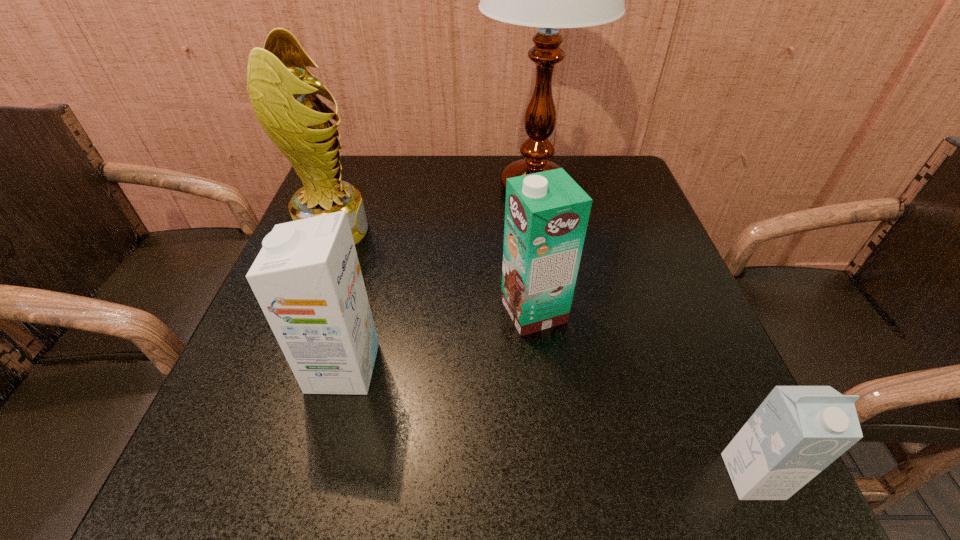
Where is `the tallest object`? the tallest object is located at coordinates (548, 0).

Locate an element on the screen. This screenshot has width=960, height=540. award is located at coordinates (283, 93).

Locate an element on the screen. This screenshot has width=960, height=540. the second carton from right to left is located at coordinates (546, 214).

Where is `the third nearest object`? This screenshot has height=540, width=960. the third nearest object is located at coordinates (546, 214).

The image size is (960, 540). What are the coordinates of `the leftmost carton` in the screenshot? It's located at (307, 279).

At what (x,y) coordinates should I click in order to perform the action: click on the fourth farthest object. Please return your answer as a coordinate pair (x, y). Looking at the image, I should click on (307, 279).

You are a GUI agent. You are given a task and a screenshot of the screen. Output one action in this format:
    pyautogui.click(x=<x>, y=<y>)
    Task: Click on the shortest object
    The image size is (960, 540).
    Given the screenshot: What is the action you would take?
    pyautogui.click(x=797, y=431)

Identify the location of the rightmost carton. Image resolution: width=960 pixels, height=540 pixels. (797, 431).

Identify the location of free space located on the right of the tallest object. (619, 188).

Locate an element on the screen. The width and height of the screenshot is (960, 540). blank space located 0.300m on the front-facing side of the second tallest object is located at coordinates (498, 231).